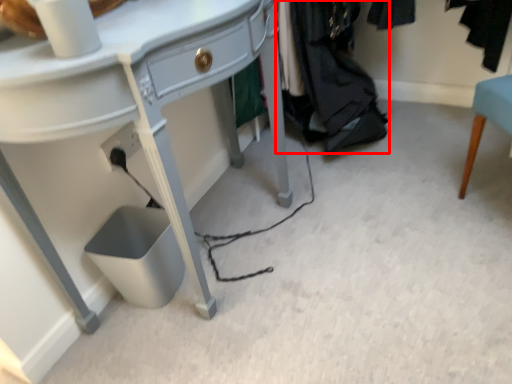
Question: In this image, where is clothing (annotated by the red box) located relative to desk?

Choices:
 (A) left
 (B) right

Answer: (B)